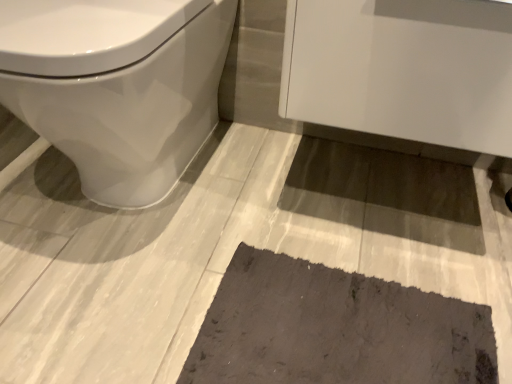
Find the location of `vacant area to the left of dark gray textured bath mat at lower center`. vacant area to the left of dark gray textured bath mat at lower center is located at coordinates (129, 283).